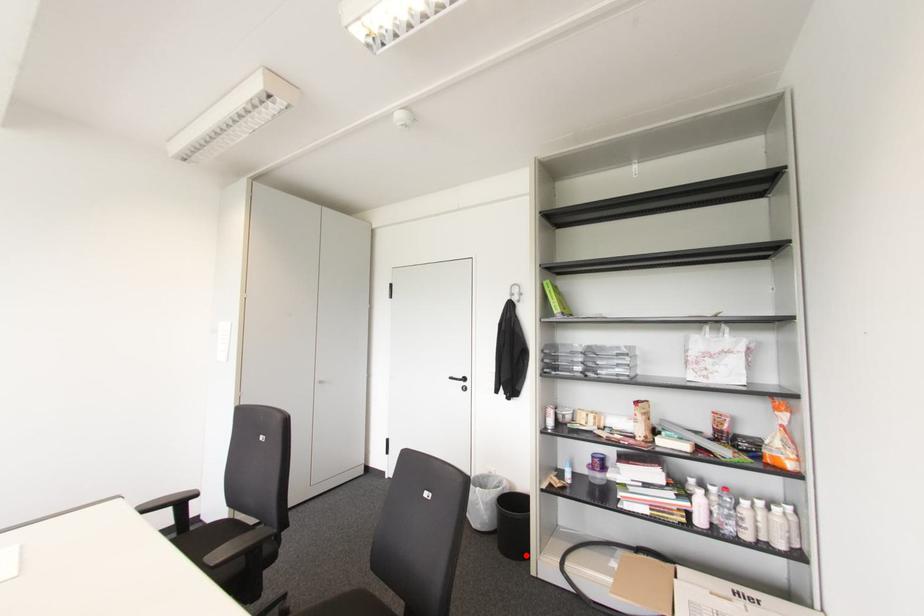
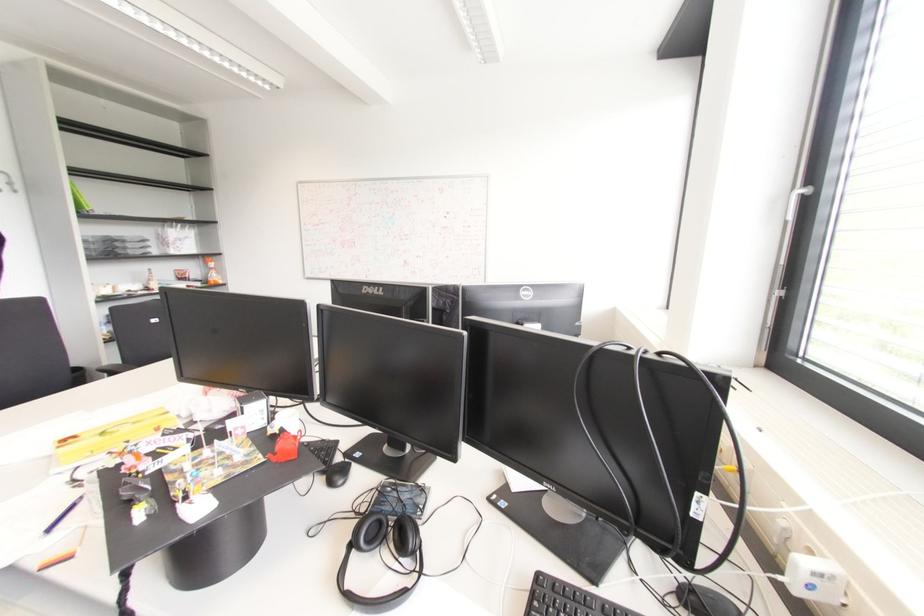
Question: I am providing you with two images of the same scene from different viewpoints. A red point is marked on the first image. At the location where the point appears in image 1, is it still visible in image 2?

Choices:
 (A) Yes
 (B) No

Answer: (B)